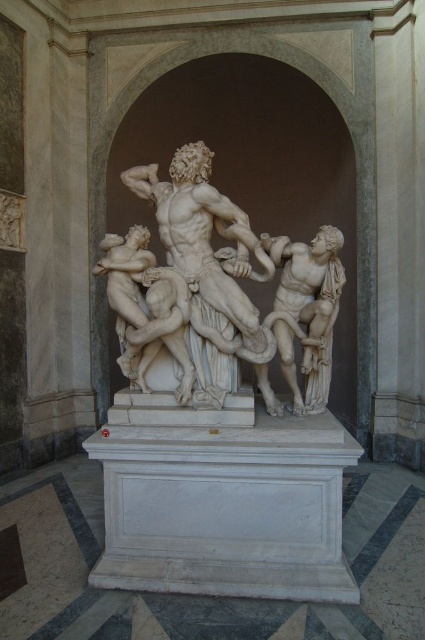
Question: Where is white marble sculpture at center located in relation to white marble statue at center in the image?

Choices:
 (A) above
 (B) below

Answer: (A)

Question: Among these objects, which one is nearest to the camera?

Choices:
 (A) white marble sculpture at center
 (B) white marble statue at center

Answer: (A)

Question: Which of the following is the farthest from the observer?

Choices:
 (A) white marble statue at center
 (B) white marble sculpture at center

Answer: (A)

Question: Does white marble sculpture at center appear on the right side of white marble statue at center?

Choices:
 (A) yes
 (B) no

Answer: (B)

Question: Which of the following is the farthest from the observer?

Choices:
 (A) (337, 312)
 (B) (181, 227)

Answer: (B)

Question: Is the position of white marble sculpture at center more distant than that of white marble statue at center?

Choices:
 (A) no
 (B) yes

Answer: (A)